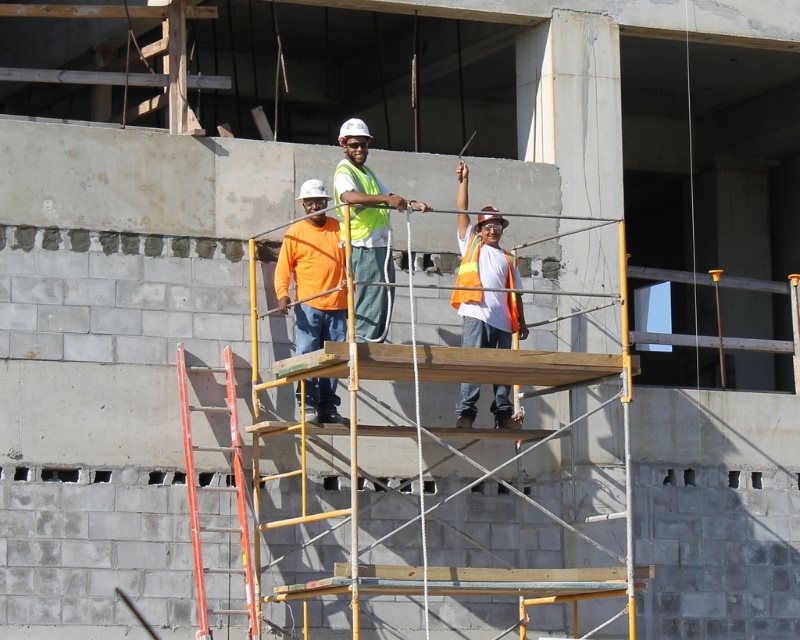
You are a safety inspector observing the construction site. You notice two orange items at the center of the scaffolding platform. Which item is taller between the orange matte shirt at center and the orange reflective safety vest at center?

The orange matte shirt at center is taller than the orange reflective safety vest at center.